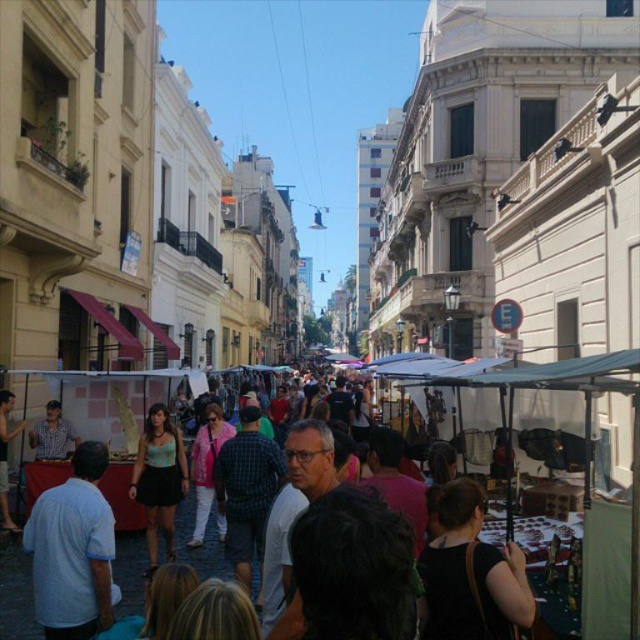
Is point (33, 428) closer to viewer compared to point (6, 493)?

No, it is not.

Is matte black shirt at center positioned in front of matte black shirt at left?

No, matte black shirt at center is behind matte black shirt at left.

What are the coordinates of `matte black shirt at center` in the screenshot? It's located at (52, 435).

At what (x,y) coordinates should I click in order to perform the action: click on matte black shirt at center. Please return your answer as a coordinate pair (x, y). This screenshot has width=640, height=640. Looking at the image, I should click on (52, 435).

Which of these two, matte black dress at center or matte black shirt at center, stands taller?

Standing taller between the two is matte black dress at center.

Can you confirm if matte black dress at center is positioned below matte black shirt at center?

Yes.

Where is `matte black dress at center`? matte black dress at center is located at coordinates (160, 480).

Which is more to the left, matte black dress at center or matte black shirt at left?

From the viewer's perspective, matte black shirt at left appears more on the left side.

Which is behind, point (148, 534) or point (3, 442)?

Point (3, 442)

Locate an element on the screen. The image size is (640, 640). matte black dress at center is located at coordinates (160, 480).